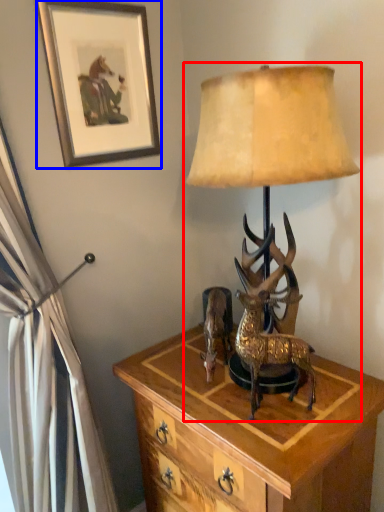
Question: Which object is further to the camera taking this photo, lamp (highlighted by a red box) or picture frame (highlighted by a blue box)?

Choices:
 (A) lamp
 (B) picture frame

Answer: (B)